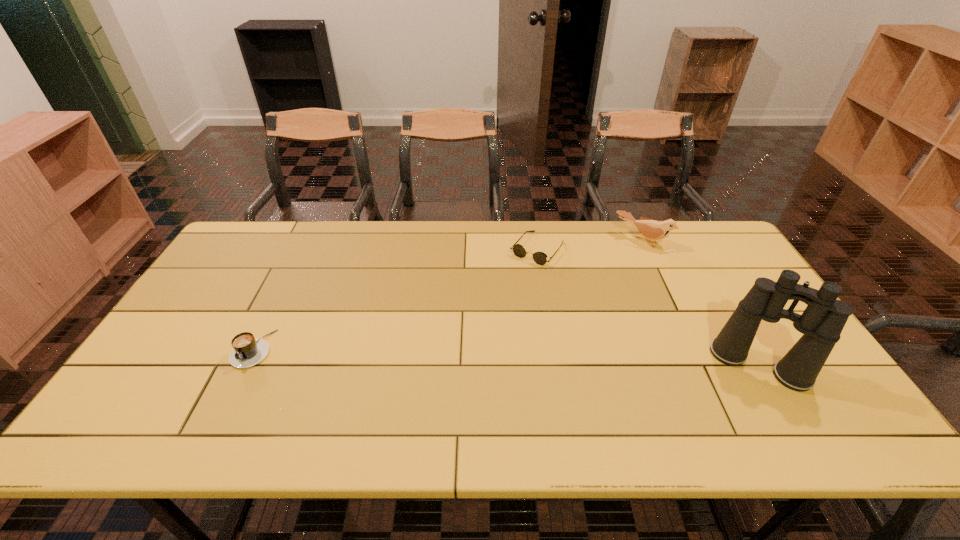
You are a GUI agent. You are given a task and a screenshot of the screen. Output one action in this format:
    pyautogui.click(x=<x>, y=<y>)
    Task: Click on the free spot at the right edge of the desktop
    
    Given the screenshot: What is the action you would take?
    pyautogui.click(x=777, y=343)

Identify the location of vacant space at the far right corner. (698, 245).

Identify the location of free space between the leftmost object and the sunglasses. Image resolution: width=960 pixels, height=540 pixels. (395, 299).

Find the location of a particular element. vacant region between the binoculars and the second object from left to right is located at coordinates (648, 307).

At what (x,y) coordinates should I click in order to perform the action: click on vacant space that's between the bird and the tallest object. Please return your answer as a coordinate pair (x, y). The height and width of the screenshot is (540, 960). Looking at the image, I should click on (701, 303).

This screenshot has width=960, height=540. I want to click on empty location between the binoculars and the cappuccino, so click(506, 357).

This screenshot has height=540, width=960. I want to click on vacant space in between the tallest object and the bird, so click(701, 303).

Find the location of a particular element. Image resolution: width=960 pixels, height=540 pixels. vacant area that lies between the tallest object and the bird is located at coordinates (701, 303).

Identify the location of vacant space that's between the cappuccino and the third object from right to left. This screenshot has height=540, width=960. (395, 299).

You are a GUI agent. You are given a task and a screenshot of the screen. Output one action in this format:
    pyautogui.click(x=<x>, y=<y>)
    Task: Click on the vacant area that lies between the tallest object and the bird
    Image resolution: width=960 pixels, height=540 pixels.
    Given the screenshot: What is the action you would take?
    pyautogui.click(x=701, y=303)